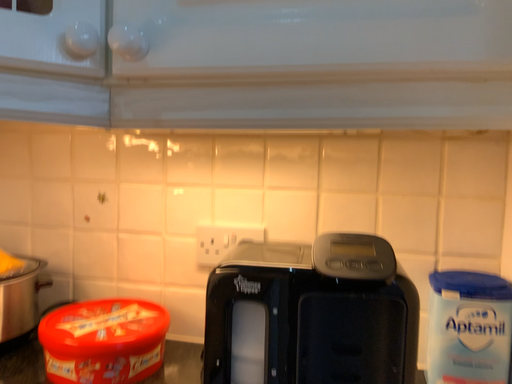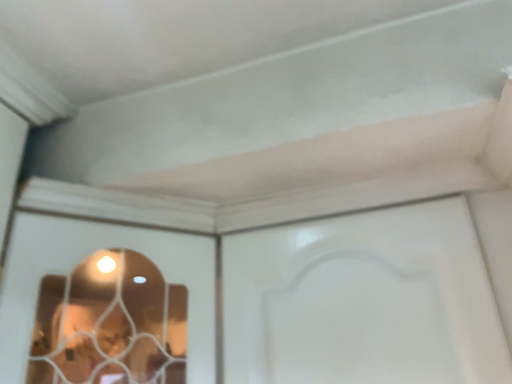
Question: Which way did the camera rotate in the video?

Choices:
 (A) rotated right
 (B) rotated left

Answer: (B)